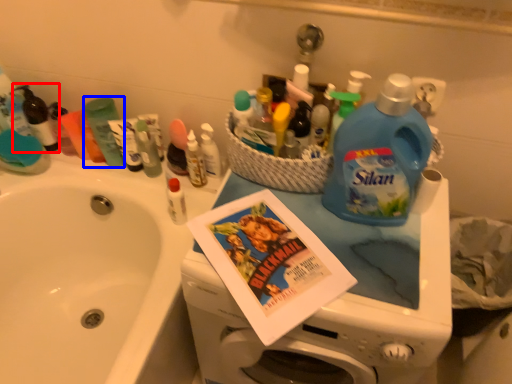
Question: Among these objects, which one is nearest to the camera, toiletry (highlighted by a red box) or toiletry (highlighted by a blue box)?

Choices:
 (A) toiletry
 (B) toiletry

Answer: (B)